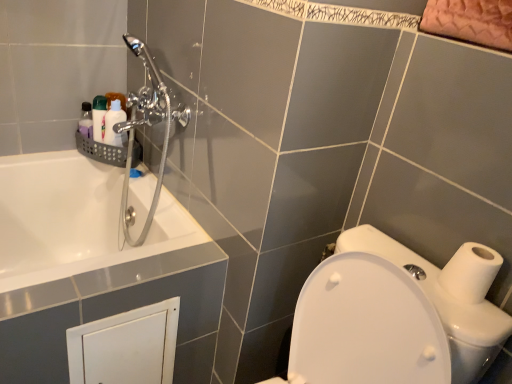
Question: Should I look upward or downward to see white glossy bottle at upper left, which appears as the second toiletry when viewed from the left?

Choices:
 (A) up
 (B) down

Answer: (A)

Question: Is chrome metallic shower head at upper left oriented towards white glossy toilet at lower right?

Choices:
 (A) no
 (B) yes

Answer: (A)

Question: Does chrome metallic shower head at upper left have a lesser height compared to white glossy toilet at lower right?

Choices:
 (A) yes
 (B) no

Answer: (B)

Question: Would you say white glossy toilet at lower right is part of chrome metallic shower head at upper left's contents?

Choices:
 (A) yes
 (B) no

Answer: (B)

Question: Can you confirm if chrome metallic shower head at upper left is thinner than white glossy toilet at lower right?

Choices:
 (A) yes
 (B) no

Answer: (A)

Question: Is chrome metallic shower head at upper left directly adjacent to white glossy toilet at lower right?

Choices:
 (A) yes
 (B) no

Answer: (B)

Question: Is chrome metallic shower head at upper left located outside white glossy toilet at lower right?

Choices:
 (A) no
 (B) yes

Answer: (B)

Question: From a real-world perspective, is white matte toilet paper at right over white glossy toilet at lower right?

Choices:
 (A) yes
 (B) no

Answer: (A)

Question: Is white glossy toilet at lower right located within white matte toilet paper at right?

Choices:
 (A) yes
 (B) no

Answer: (B)

Question: Is white matte toilet paper at right completely or partially outside of white glossy toilet at lower right?

Choices:
 (A) yes
 (B) no

Answer: (A)

Question: Is white matte toilet paper at right thinner than white glossy toilet at lower right?

Choices:
 (A) yes
 (B) no

Answer: (A)

Question: Does white matte toilet paper at right have a greater height compared to white glossy toilet at lower right?

Choices:
 (A) no
 (B) yes

Answer: (A)

Question: Is white matte toilet paper at right positioned behind white glossy toilet at lower right?

Choices:
 (A) yes
 (B) no

Answer: (A)

Question: Is chrome metallic shower head at upper left positioned far away from white glossy bottle at upper left, which ranks as the first toiletry in right-to-left order?

Choices:
 (A) no
 (B) yes

Answer: (A)